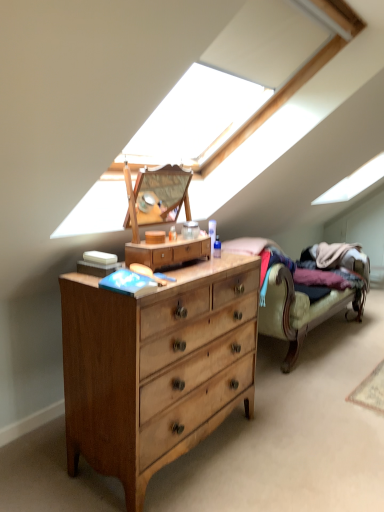
Question: From the image's perspective, is velvet beige couch at right above light wood chest of drawers at center?

Choices:
 (A) no
 (B) yes

Answer: (B)

Question: Does velvet beige couch at right have a greater height compared to light wood chest of drawers at center?

Choices:
 (A) yes
 (B) no

Answer: (B)

Question: Can you confirm if velvet beige couch at right is smaller than light wood chest of drawers at center?

Choices:
 (A) no
 (B) yes

Answer: (A)

Question: From the image's perspective, is velvet beige couch at right under light wood chest of drawers at center?

Choices:
 (A) yes
 (B) no

Answer: (B)

Question: Is light wood chest of drawers at center located within velvet beige couch at right?

Choices:
 (A) no
 (B) yes

Answer: (A)

Question: Can you confirm if velvet beige couch at right is positioned to the left of light wood chest of drawers at center?

Choices:
 (A) no
 (B) yes

Answer: (A)

Question: Is light wood chest of drawers at center completely or partially outside of light brown wood dresser at center?

Choices:
 (A) no
 (B) yes

Answer: (B)

Question: Is light wood chest of drawers at center positioned far away from light brown wood dresser at center?

Choices:
 (A) no
 (B) yes

Answer: (A)

Question: Considering the relative sizes of light wood chest of drawers at center and light brown wood dresser at center in the image provided, is light wood chest of drawers at center taller than light brown wood dresser at center?

Choices:
 (A) no
 (B) yes

Answer: (B)

Question: Considering the relative sizes of light wood chest of drawers at center and light brown wood dresser at center in the image provided, is light wood chest of drawers at center shorter than light brown wood dresser at center?

Choices:
 (A) yes
 (B) no

Answer: (B)

Question: From the image's perspective, does light wood chest of drawers at center appear higher than light brown wood dresser at center?

Choices:
 (A) no
 (B) yes

Answer: (A)

Question: Is light brown wood dresser at center a part of light wood chest of drawers at center?

Choices:
 (A) yes
 (B) no

Answer: (B)

Question: From a real-world perspective, is velvet beige couch at right over light brown wood dresser at center?

Choices:
 (A) yes
 (B) no

Answer: (B)